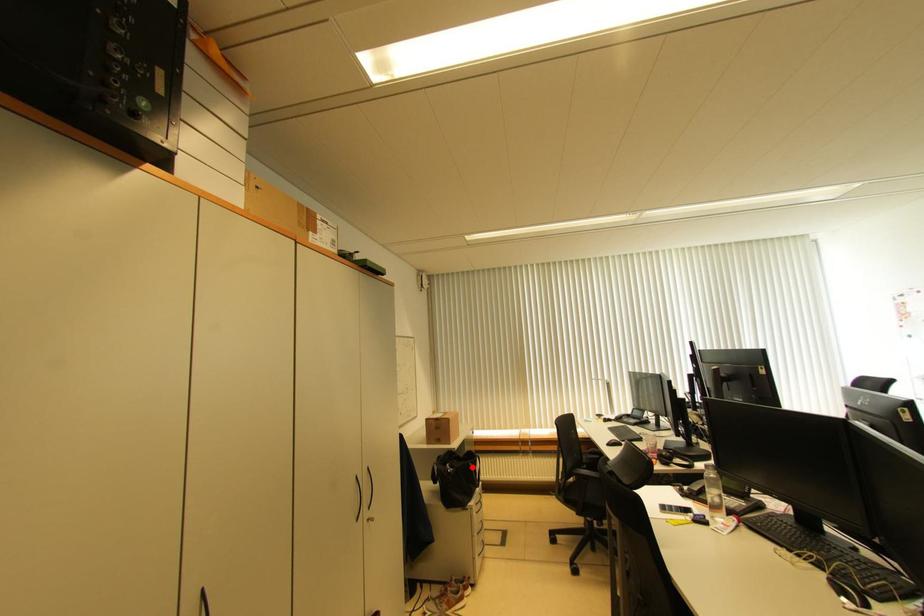
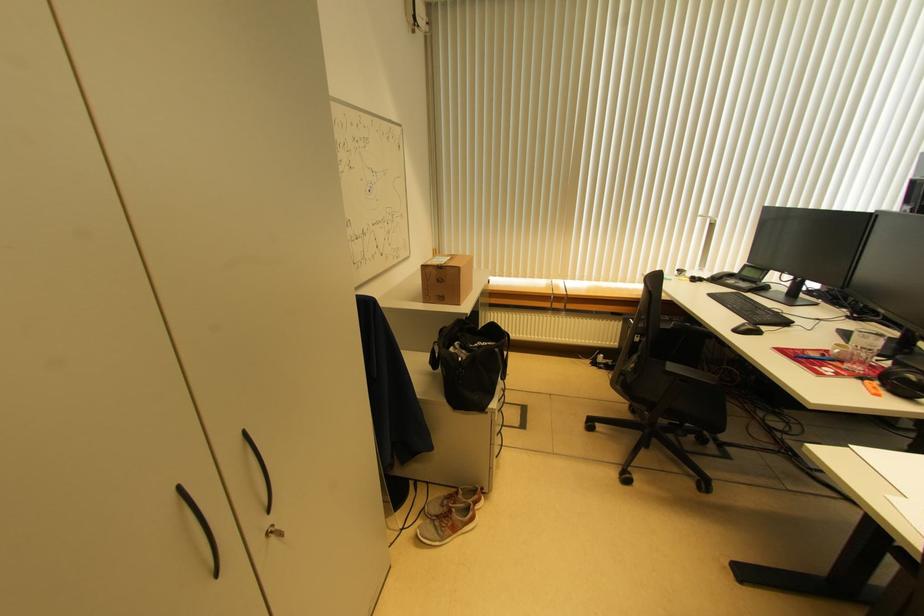
Where in the second image is the point corresponding to the highlighted location from the first image?

(499, 353)